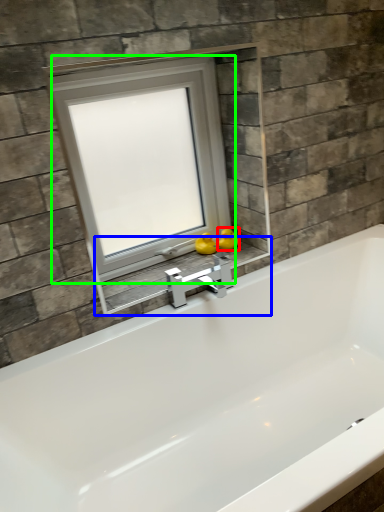
Question: Considering the real-world distances, which object is farthest from duck (highlighted by a red box)? window sill (highlighted by a blue box) or window (highlighted by a green box)?

Choices:
 (A) window sill
 (B) window

Answer: (B)